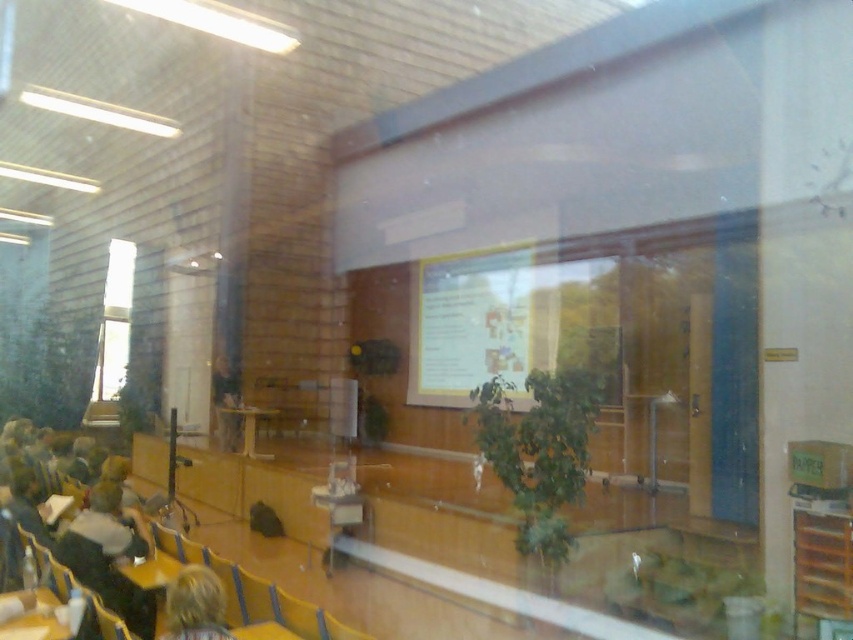
In the scene shown: You are standing at the entrance of the lecture hall and notice a person with blonde hair at lower left. If you want to approach them, which direction should you move relative to your current position?

The blonde hair at lower left is located at point 0.947 on the x axis and 0.230 on the y axis. To approach them, you should move towards the lower left direction from your current position at the entrance.

You are standing at the center of the room and want to look at the blonde hair at lower left. In which direction should you turn your head?

The blonde hair at lower left is located at point 0.947 on the x axis and 0.230 on the y axis. Since the x coordinate is closer to 1, it is on the right side of the image. The y coordinate is closer to 0.2, which is lower in the image. Therefore, you should turn your head to the right and downward to look at the blonde hair at lower left.